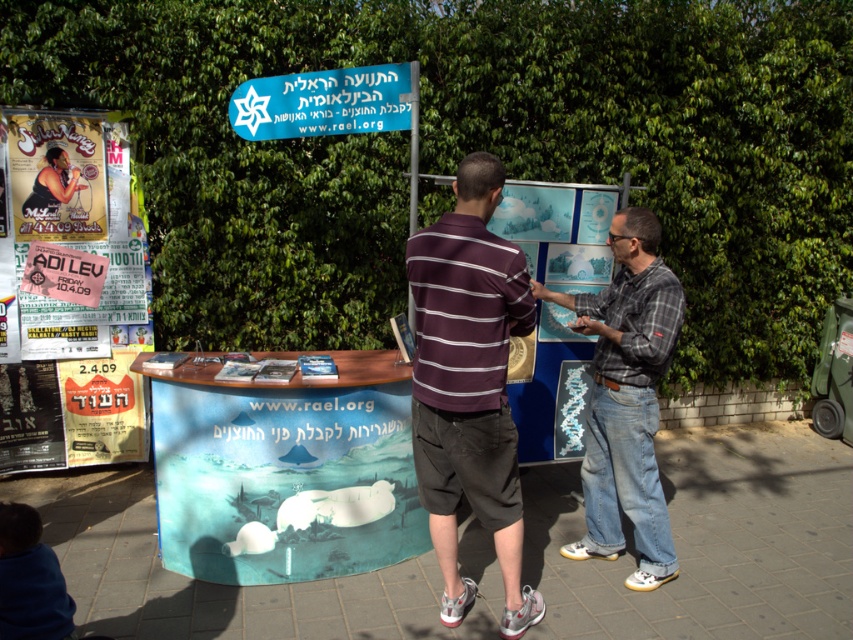
Question: Does dark purple striped shirt at center appear on the left side of plaid shirt at center?

Choices:
 (A) yes
 (B) no

Answer: (A)

Question: Can you confirm if dark purple striped shirt at center is positioned above plaid shirt at center?

Choices:
 (A) yes
 (B) no

Answer: (B)

Question: Which point is closer to the camera taking this photo?

Choices:
 (A) (416, 358)
 (B) (654, 413)

Answer: (A)

Question: Which of the following is the farthest from the observer?

Choices:
 (A) (425, 310)
 (B) (282, 102)
 (C) (15, 177)

Answer: (C)

Question: Does paper posters at left have a greater width compared to dark purple striped shirt at center?

Choices:
 (A) yes
 (B) no

Answer: (A)

Question: Based on their relative distances, which object is farther from the paper posters at left?

Choices:
 (A) plaid shirt at center
 (B) blue plastic sign at upper center
 (C) dark purple striped shirt at center

Answer: (A)